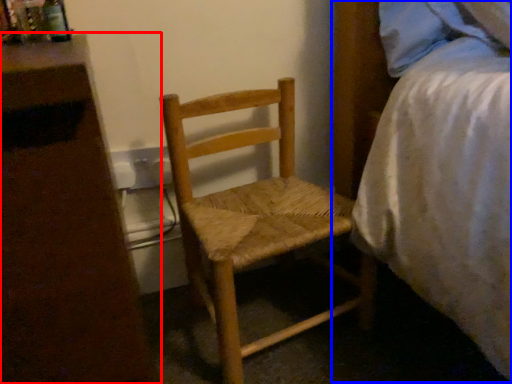
Question: Which object appears closest to the camera in this image, nightstand (highlighted by a red box) or bed (highlighted by a blue box)?

Choices:
 (A) nightstand
 (B) bed

Answer: (A)